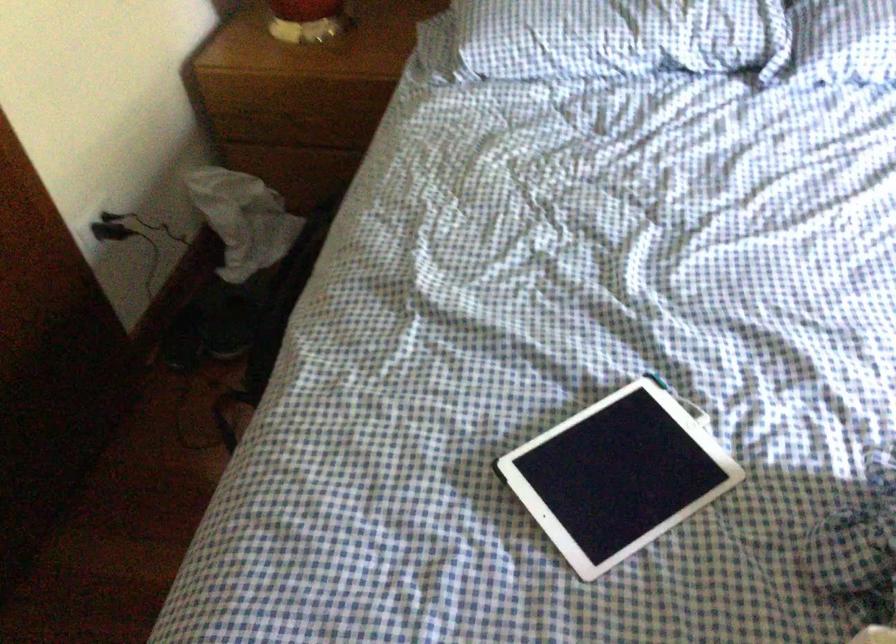
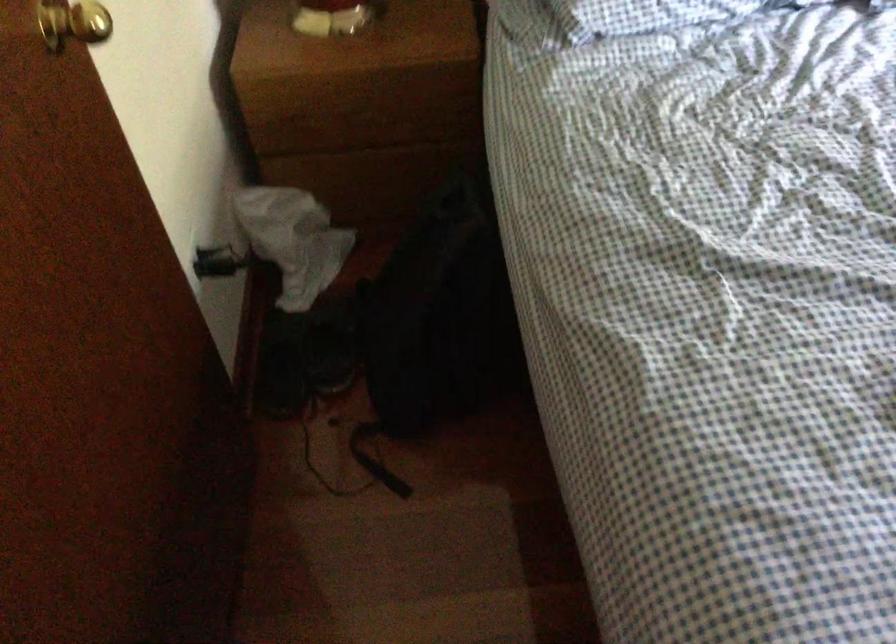
Question: The camera is either moving clockwise (left) or counter-clockwise (right) around the object. The first image is from the beginning of the video and the second image is from the end. Is the camera moving left or right when shooting the video?

Choices:
 (A) Left
 (B) Right

Answer: (A)